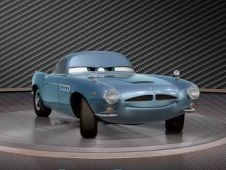
In order to click on wall in this screenshot , I will do `click(156, 51)`.